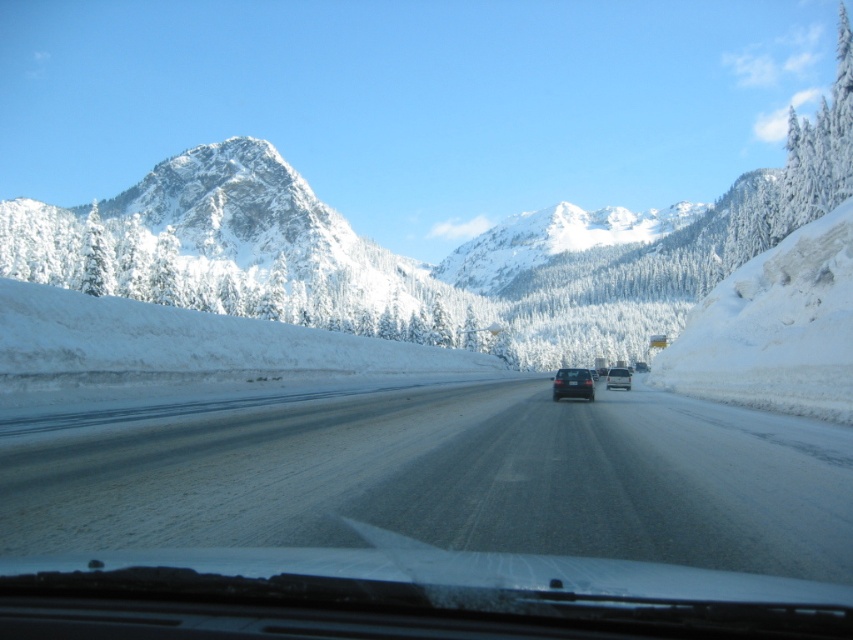
Looking at this image, who is positioned more to the right, satin black sedan at center or satin silver van at center?

satin silver van at center is more to the right.

Is point (589, 392) farther from camera compared to point (614, 378)?

No.

Find the location of a particular element. The image size is (853, 640). satin black sedan at center is located at coordinates (572, 384).

Does smooth asphalt highway at center appear on the left side of satin black sedan at center?

Correct, you'll find smooth asphalt highway at center to the left of satin black sedan at center.

Is smooth asphalt highway at center bigger than satin black sedan at center?

Yes.

Who is more forward, (165, 529) or (592, 388)?

Point (165, 529)

This screenshot has height=640, width=853. I want to click on smooth asphalt highway at center, so click(448, 477).

Is the position of smooth asphalt highway at center more distant than that of satin silver van at center?

No, it is not.

Between smooth asphalt highway at center and satin silver van at center, which one is positioned higher?

smooth asphalt highway at center

Is point (453, 420) less distant than point (619, 380)?

Yes, point (453, 420) is in front of point (619, 380).

Identify the location of smooth asphalt highway at center. (448, 477).